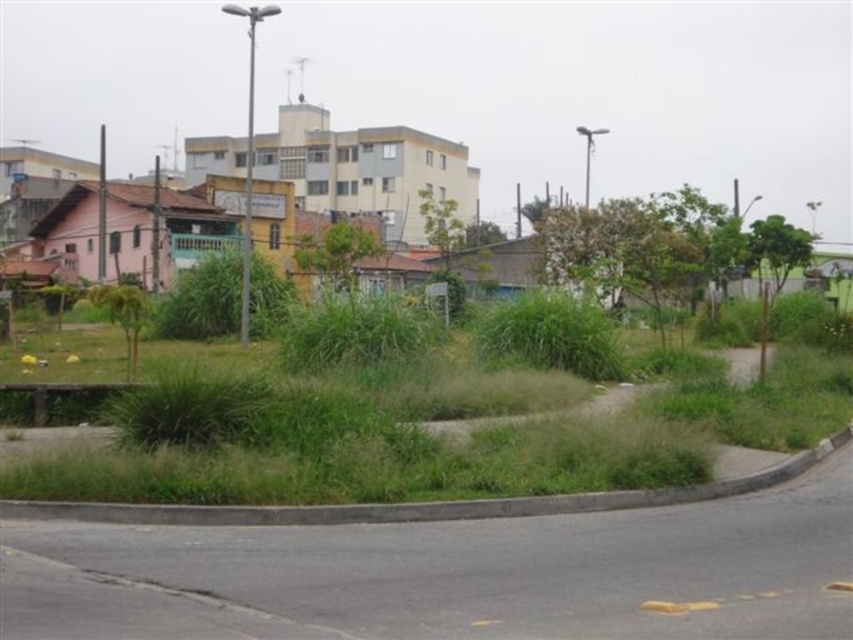
Is green grass at lower center taller than green grassy weed at lower left?

No.

Between green grass at lower center and green grassy weed at lower left, which one has less height?

green grass at lower center

Is point (439, 460) farther from viewer compared to point (128, 314)?

No, (439, 460) is closer to viewer.

The image size is (853, 640). Identify the location of green grass at lower center. (450, 449).